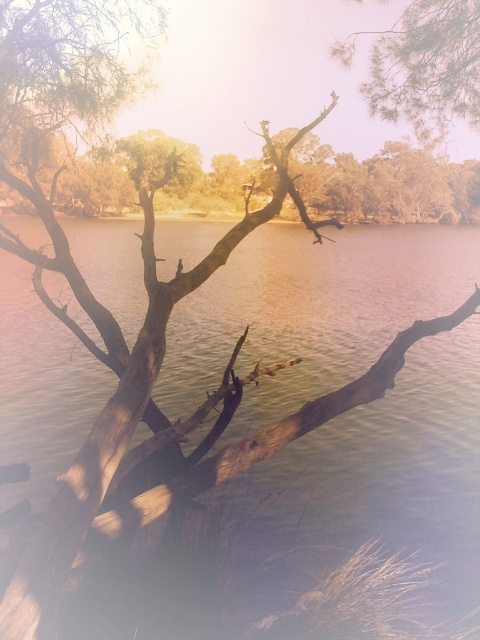
You are standing on the bank of the water and see the brown matte water at center and the green textured pine branch at upper right. Which object is located to the left of the other?

The green textured pine branch at upper right is located to the left of the brown matte water at center.

You are standing at the edge of the scene and want to reach the brown matte water at center. Which direction should you move in to get there?

The brown matte water at center is located at point coordinates 0.803 on the x and 0.660 on the y axis, so you should move towards the center of the scene to reach it.

You are an observer standing in front of the scene. You see the brown matte water at center and the green textured pine branch at upper right. Which object is closer to you?

The brown matte water at center is closer to you because it is in front of the green textured pine branch at upper right.